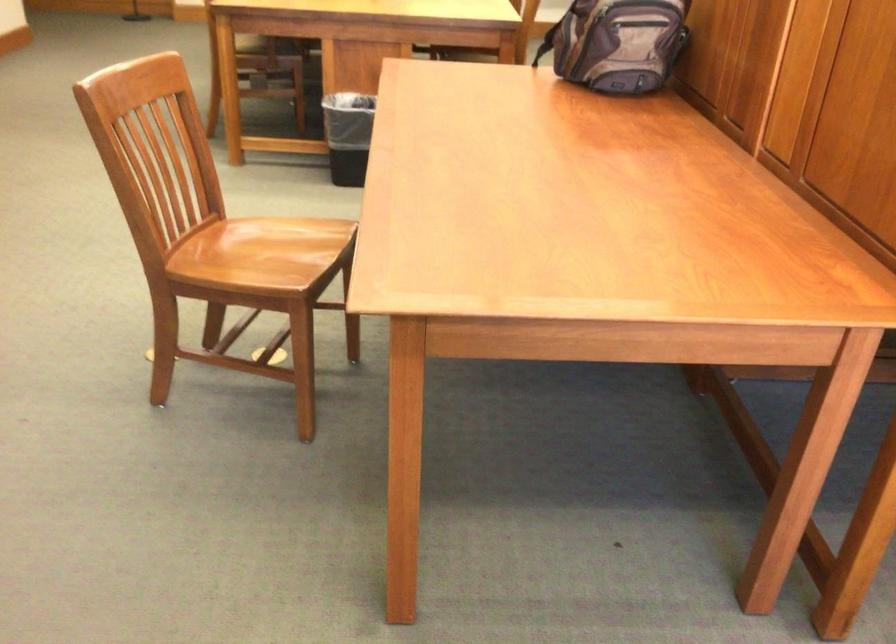
Which object does [348,120] point to?

It refers to a black trash can.